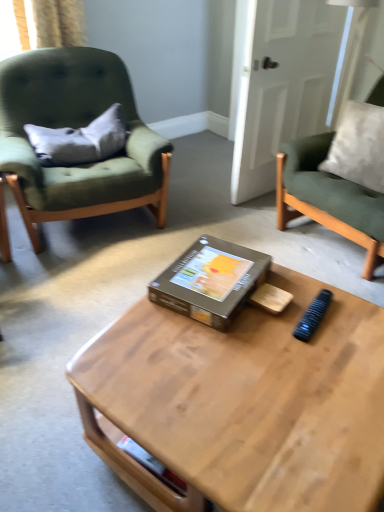
Where is `vacant space to the right of black plastic remote control at center`? vacant space to the right of black plastic remote control at center is located at coordinates (356, 317).